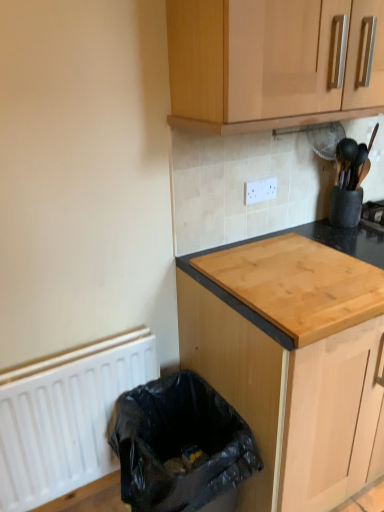
Question: From a real-world perspective, is wooden cabinet at upper center, which is the 1th cabinetry in top-to-bottom order, under natural wood cutting board at center, which appears as the 2th cabinetry when viewed from the top?

Choices:
 (A) no
 (B) yes

Answer: (A)

Question: Is wooden cabinet at upper center, arranged as the 2th cabinetry when ordered from the bottom, not close to natural wood cutting board at center, which is the first cabinetry from bottom to top?

Choices:
 (A) no
 (B) yes

Answer: (A)

Question: Is wooden cabinet at upper center, which is the 1th cabinetry in top-to-bottom order, not within natural wood cutting board at center, which appears as the 2th cabinetry when viewed from the top?

Choices:
 (A) no
 (B) yes

Answer: (B)

Question: Is wooden cabinet at upper center, arranged as the 2th cabinetry when ordered from the bottom, with natural wood cutting board at center, which is the first cabinetry from bottom to top?

Choices:
 (A) yes
 (B) no

Answer: (B)

Question: Considering the relative sizes of wooden cabinet at upper center, arranged as the 2th cabinetry when ordered from the bottom, and natural wood cutting board at center, which is the first cabinetry from bottom to top, in the image provided, is wooden cabinet at upper center, arranged as the 2th cabinetry when ordered from the bottom, thinner than natural wood cutting board at center, which is the first cabinetry from bottom to top,?

Choices:
 (A) yes
 (B) no

Answer: (A)

Question: In terms of height, does wooden cabinet at upper center, which is the 1th cabinetry in top-to-bottom order, look taller or shorter compared to white plastic electric outlet at upper center?

Choices:
 (A) tall
 (B) short

Answer: (A)

Question: Considering the positions of wooden cabinet at upper center, which is the 1th cabinetry in top-to-bottom order, and white plastic electric outlet at upper center in the image, is wooden cabinet at upper center, which is the 1th cabinetry in top-to-bottom order, wider or thinner than white plastic electric outlet at upper center?

Choices:
 (A) wide
 (B) thin

Answer: (A)

Question: From a real-world perspective, is wooden cabinet at upper center, which is the 1th cabinetry in top-to-bottom order, above or below white plastic electric outlet at upper center?

Choices:
 (A) above
 (B) below

Answer: (A)

Question: Is wooden cabinet at upper center, which is the 1th cabinetry in top-to-bottom order, to the left or to the right of white plastic electric outlet at upper center in the image?

Choices:
 (A) right
 (B) left

Answer: (A)

Question: From the image's perspective, relative to natural wood cutting board at center, which is the first cabinetry from bottom to top, is black plastic bag at lower left above or below?

Choices:
 (A) above
 (B) below

Answer: (B)

Question: Considering the positions of black plastic bag at lower left and natural wood cutting board at center, which appears as the 2th cabinetry when viewed from the top, in the image, is black plastic bag at lower left wider or thinner than natural wood cutting board at center, which appears as the 2th cabinetry when viewed from the top,?

Choices:
 (A) wide
 (B) thin

Answer: (B)

Question: From a real-world perspective, is black plastic bag at lower left positioned above or below natural wood cutting board at center, which appears as the 2th cabinetry when viewed from the top?

Choices:
 (A) above
 (B) below

Answer: (B)

Question: Do you think black plastic bag at lower left is within natural wood cutting board at center, which is the first cabinetry from bottom to top, or outside of it?

Choices:
 (A) inside
 (B) outside

Answer: (B)

Question: From a real-world perspective, is white matte radiator at lower left above or below black plastic bag at lower left?

Choices:
 (A) above
 (B) below

Answer: (A)

Question: Is white matte radiator at lower left situated inside black plastic bag at lower left or outside?

Choices:
 (A) inside
 (B) outside

Answer: (B)